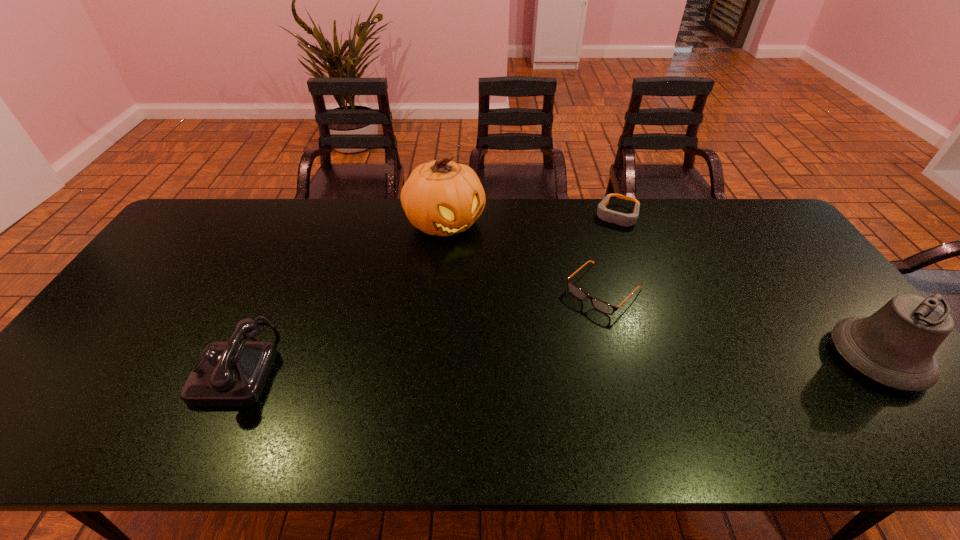
Find the location of a particular element. This screenshot has height=540, width=960. free spot located 0.190m on the dial of the third shortest object is located at coordinates (130, 363).

Where is `vacant position located 0.130m on the left of the bell`? vacant position located 0.130m on the left of the bell is located at coordinates (781, 358).

Identify the location of vacant region located on the front-facing side of the third nearest object. The image size is (960, 540). (540, 352).

The image size is (960, 540). Identify the location of vacant space located on the front-facing side of the third nearest object. (504, 387).

Find the location of a particular element. This screenshot has height=540, width=960. vacant space located on the front-facing side of the third nearest object is located at coordinates (498, 393).

At what (x,y) coordinates should I click in order to perform the action: click on vacant region located on the front face of the pumpkin. Please return your answer as a coordinate pair (x, y). This screenshot has width=960, height=540. Looking at the image, I should click on (488, 267).

You are a GUI agent. You are given a task and a screenshot of the screen. Output one action in this format:
    pyautogui.click(x=<x>, y=<y>)
    Task: Click on the vacant space positioned on the front face of the pumpkin
    The width and height of the screenshot is (960, 540).
    Given the screenshot: What is the action you would take?
    pyautogui.click(x=496, y=276)

At what (x,y) coordinates should I click in order to perform the action: click on blank area located 0.180m on the front face of the pumpkin. Please return your answer as a coordinate pair (x, y). Image resolution: width=960 pixels, height=540 pixels. Looking at the image, I should click on (496, 276).

Find the location of a particular element. This screenshot has height=540, width=960. blank space located on the front and back of the goggles is located at coordinates (577, 305).

Locate an element on the screen. The image size is (960, 540). free space located on the front and back of the goggles is located at coordinates (577, 305).